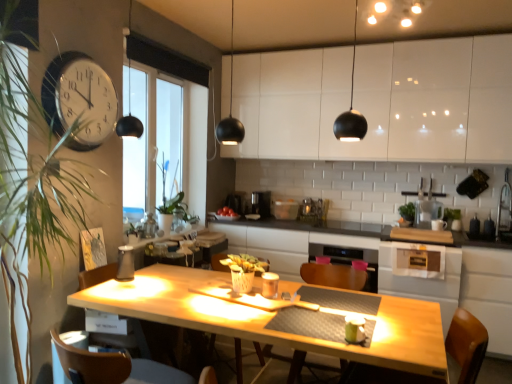
Question: Does wooden at center have a lesser width compared to wooden chair at center?

Choices:
 (A) no
 (B) yes

Answer: (A)

Question: From a real-world perspective, does wooden at center sit lower than wooden chair at center?

Choices:
 (A) yes
 (B) no

Answer: (B)

Question: From the image's perspective, is wooden at center under wooden chair at center?

Choices:
 (A) yes
 (B) no

Answer: (B)

Question: Can you confirm if wooden at center is bigger than wooden chair at center?

Choices:
 (A) yes
 (B) no

Answer: (A)

Question: Is wooden at center looking in the opposite direction of wooden chair at center?

Choices:
 (A) yes
 (B) no

Answer: (A)

Question: Considering the relative positions of wooden at center and wooden chair at center in the image provided, is wooden at center to the right of wooden chair at center from the viewer's perspective?

Choices:
 (A) yes
 (B) no

Answer: (A)

Question: Is transparent glass window at center completely or partially inside transparent plastic pitcher at upper right, the 1th appliance viewed from the top?

Choices:
 (A) yes
 (B) no

Answer: (B)

Question: Is transparent plastic pitcher at upper right, placed as the first appliance when sorted from right to left, not within transparent glass window at center?

Choices:
 (A) yes
 (B) no

Answer: (A)

Question: From a real-world perspective, is transparent plastic pitcher at upper right, placed as the first appliance when sorted from right to left, below transparent glass window at center?

Choices:
 (A) yes
 (B) no

Answer: (A)

Question: From the image's perspective, is transparent plastic pitcher at upper right, the second appliance ordered from the bottom, on top of transparent glass window at center?

Choices:
 (A) yes
 (B) no

Answer: (B)

Question: Considering the relative positions of transparent plastic pitcher at upper right, the 1th appliance viewed from the top, and transparent glass window at center in the image provided, is transparent plastic pitcher at upper right, the 1th appliance viewed from the top, to the right of transparent glass window at center from the viewer's perspective?

Choices:
 (A) no
 (B) yes

Answer: (B)

Question: Considering the relative sizes of transparent plastic pitcher at upper right, the second appliance ordered from the bottom, and transparent glass window at center in the image provided, is transparent plastic pitcher at upper right, the second appliance ordered from the bottom, wider than transparent glass window at center?

Choices:
 (A) no
 (B) yes

Answer: (B)

Question: Is transparent plastic pitcher at upper right, which appears as the second appliance when viewed from the front, in front of white glossy cabinets at upper center?

Choices:
 (A) no
 (B) yes

Answer: (A)